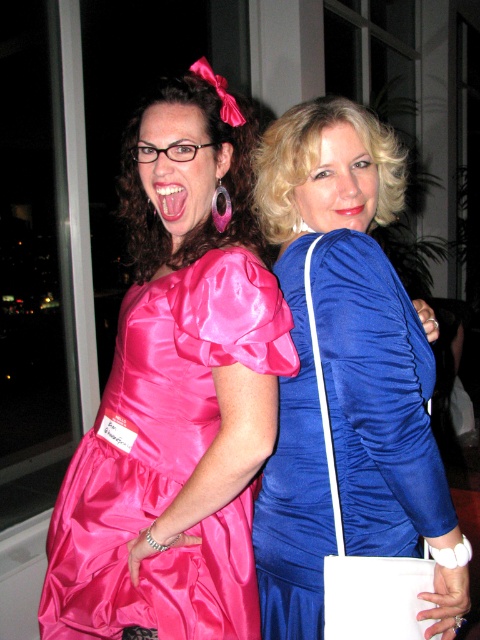
Question: In this image, where is blue satin dress at center located relative to shiny pink satin dress at center?

Choices:
 (A) below
 (B) above

Answer: (B)

Question: Can you confirm if blue satin dress at center is bigger than shiny pink satin dress at center?

Choices:
 (A) yes
 (B) no

Answer: (A)

Question: Observing the image, what is the correct spatial positioning of blue satin dress at center in reference to shiny pink satin dress at center?

Choices:
 (A) above
 (B) below

Answer: (A)

Question: Which point is closer to the camera taking this photo?

Choices:
 (A) (315, 152)
 (B) (127, 323)

Answer: (A)

Question: Which point appears closest to the camera in this image?

Choices:
 (A) (326, 550)
 (B) (215, 541)

Answer: (A)